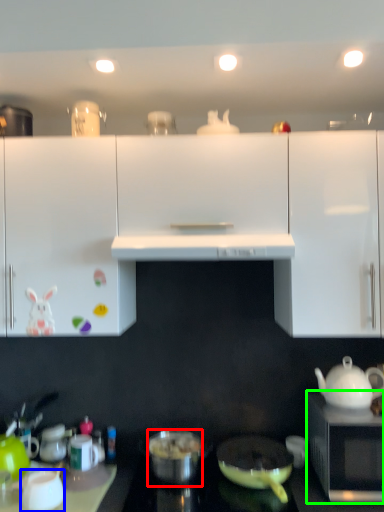
Question: Considering the real-world distances, which object is closest to pot/pan (highlighted by a red box)? coffee cup (highlighted by a blue box) or microwave oven (highlighted by a green box).

Choices:
 (A) coffee cup
 (B) microwave oven

Answer: (A)